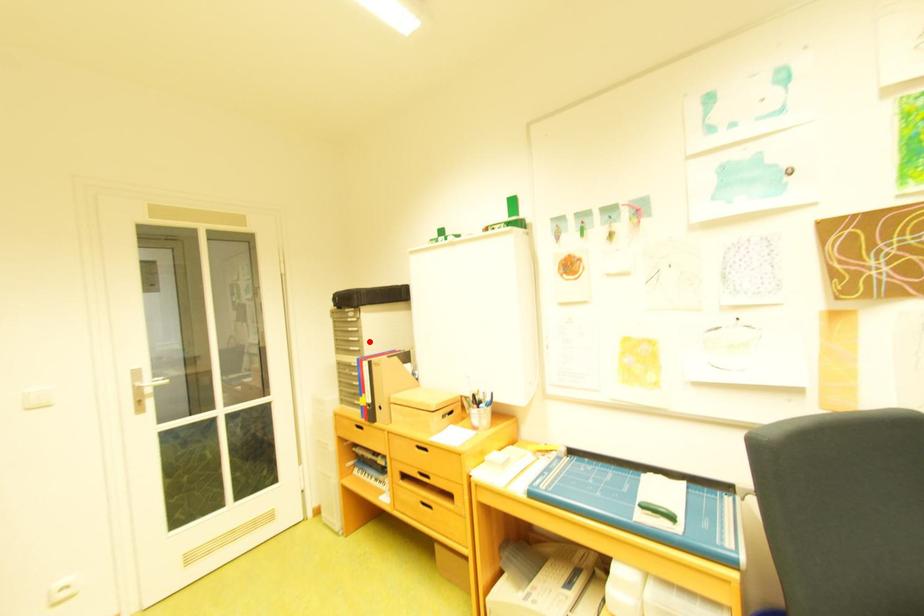
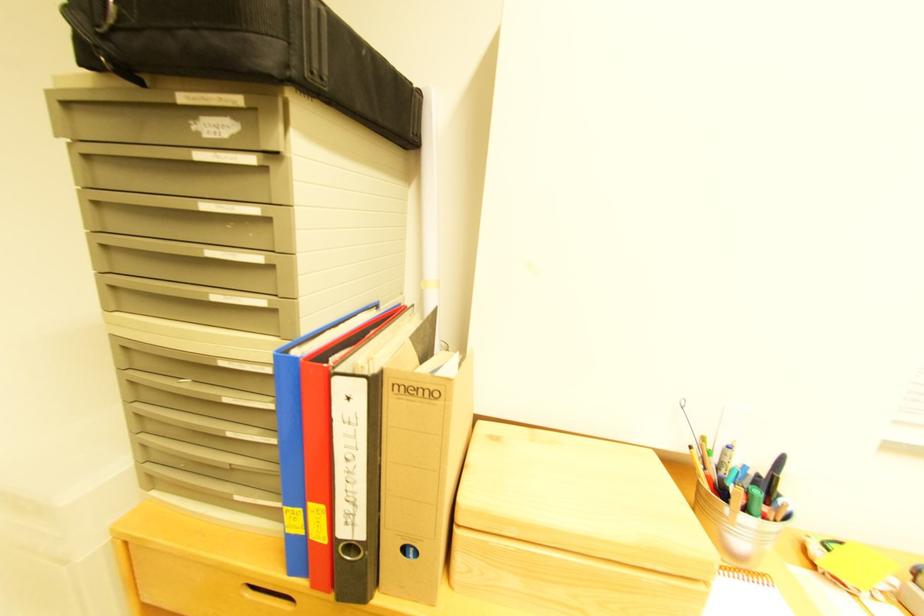
Find the pixel in the second image that matches the highlighted location in the first image.

(282, 268)